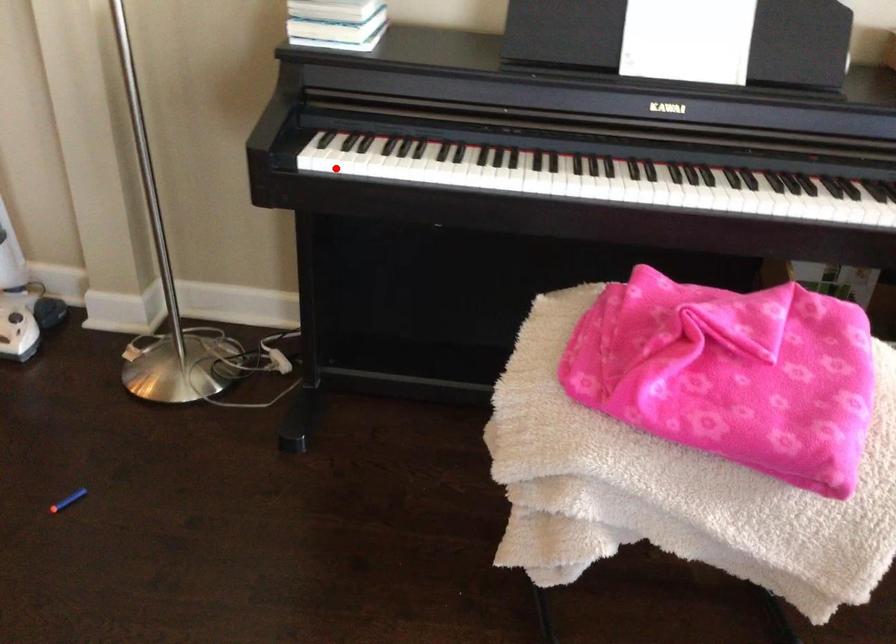
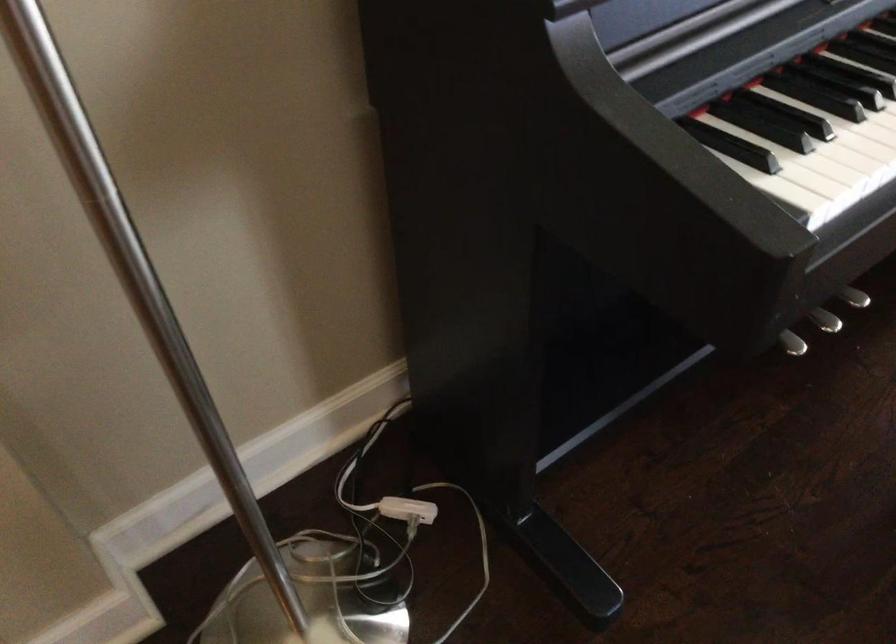
Find the pixel in the second image that matches the highlighted location in the first image.

(851, 196)